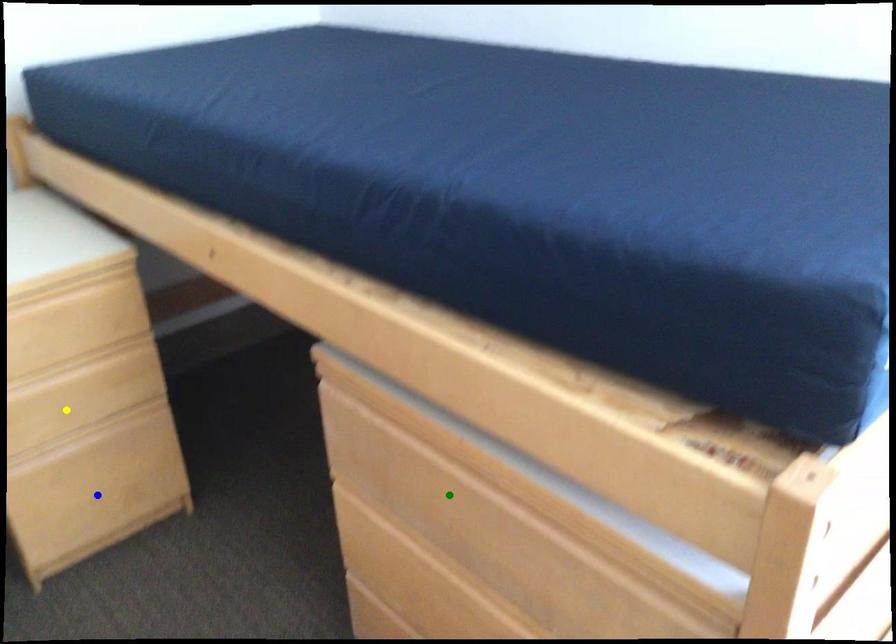
Order these from farthest to nearest:
green point, blue point, yellow point

yellow point → blue point → green point